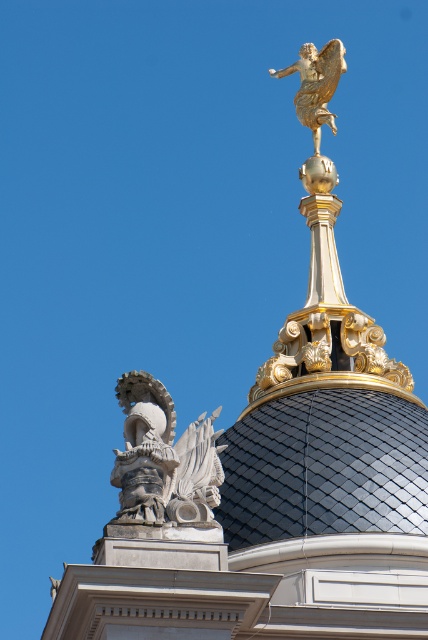
You are an architect analyzing the dome structure. You need to locate the white stone eagle at lower left. Where exactly is it positioned in the image?

The white stone eagle at lower left is positioned at point (x=163, y=460) in the image.

You are an architect examining the dome structure. You notice two points marked on the dome surface at coordinates point (139, 508) and point (341, 65). Which point is closer to the viewer?

Point (139, 508) is in front of point (341, 65), so it is closer to the viewer.

You are an architect designing a new building and want to ensure there is enough space between the white stone eagle at lower left and the gold metallic angel at upper center to allow for a maintenance walkway. The walkway requires a minimum clearance of 30 meters. Can the walkway be safely placed between them?

The white stone eagle at lower left is 35.38 meters away from the gold metallic angel at upper center, which exceeds the required 30 meters clearance. Therefore, the maintenance walkway can be safely placed between them.